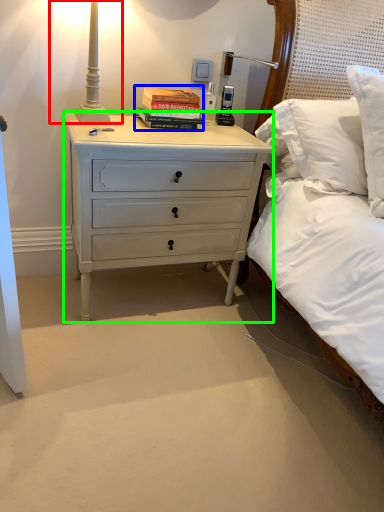
Question: Which object is positioned farthest from bedside lamp (highlighted by a red box)? Select from book (highlighted by a blue box) and nightstand (highlighted by a green box).

Choices:
 (A) book
 (B) nightstand

Answer: (B)